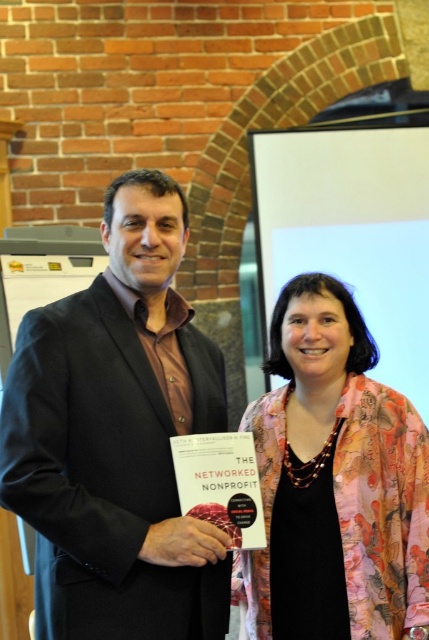
You are organizing a charity event and need to decide which outfit to wear. You have the black matte suit at left and the floral silk jacket at center. Based on the image, which one would you choose if you want to appear more authoritative?

The black matte suit at left has a larger size compared to the floral silk jacket at center, making it a better choice for appearing more authoritative as larger outfits often convey confidence and authority.

You are standing in the room and want to determine which of the two points, point (81,604) or point (322,586), is nearer to you. Based on the scene description, can you identify the closer point?

Point (81,604) is closer to the viewer than point (322,586).

You are attending a professional event and notice two people in the image. The black matte suit at left and the floral silk jacket at center are both standing. Which one is positioned more to the left?

The black matte suit at left is positioned more to the left than the floral silk jacket at center.